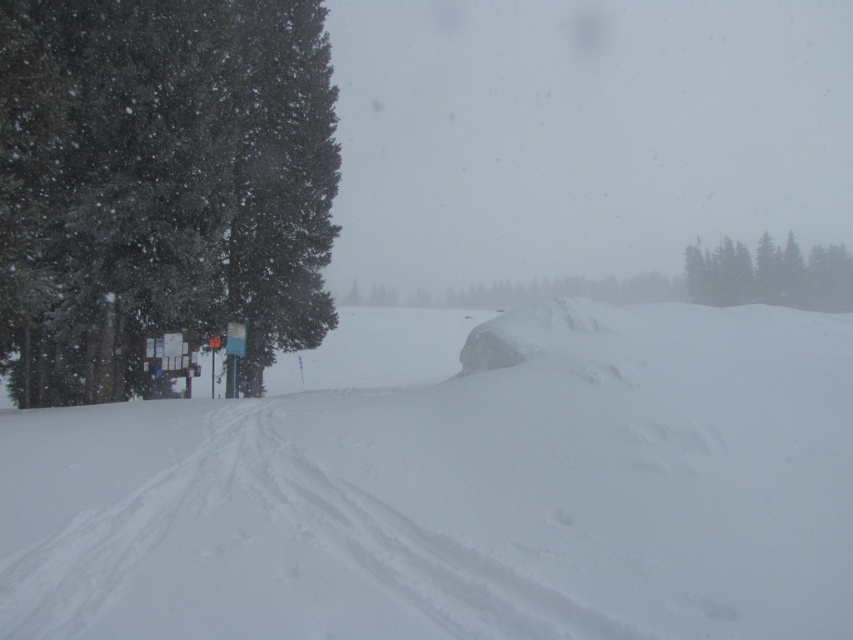
Question: Estimate the real-world distances between objects in this image. Which object is farther from the green textured trees at upper right?

Choices:
 (A) snow-covered evergreen at left
 (B) white powdery snow at center

Answer: (B)

Question: Does white powdery snow at center have a greater width compared to snow-covered evergreen at left?

Choices:
 (A) no
 (B) yes

Answer: (B)

Question: Observing the image, what is the correct spatial positioning of white powdery snow at center in reference to green textured trees at upper right?

Choices:
 (A) below
 (B) above

Answer: (A)

Question: Which is farther from the snow-covered evergreen at left?

Choices:
 (A) white powdery snow at center
 (B) green textured trees at upper right

Answer: (B)

Question: Is white powdery snow at center to the left of snow-covered evergreen at left from the viewer's perspective?

Choices:
 (A) no
 (B) yes

Answer: (A)

Question: Which point is farther to the camera?

Choices:
 (A) snow-covered evergreen at left
 (B) green textured trees at upper right

Answer: (B)